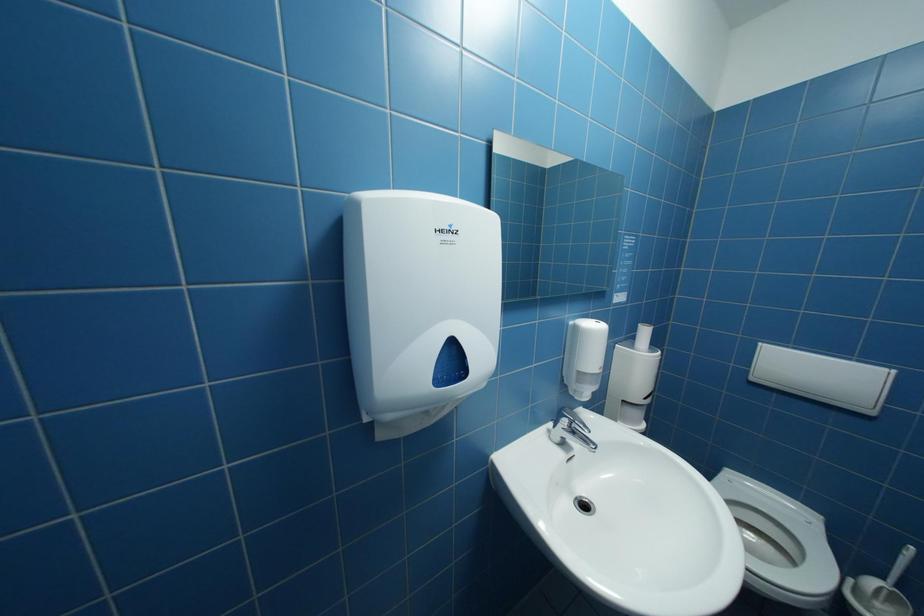
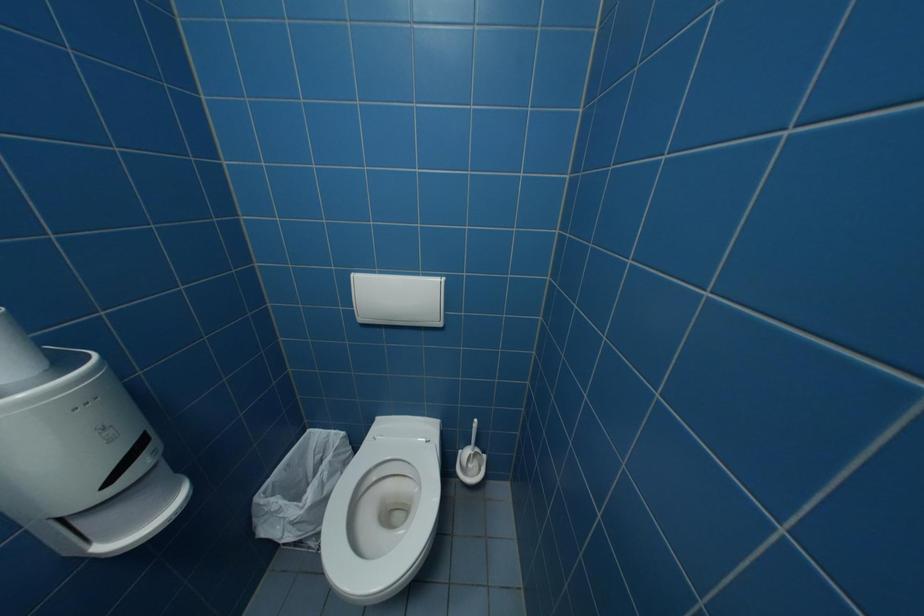
The images are taken continuously from a first-person perspective. In which direction is your viewpoint rotating?

The camera's rotation is toward right-down.